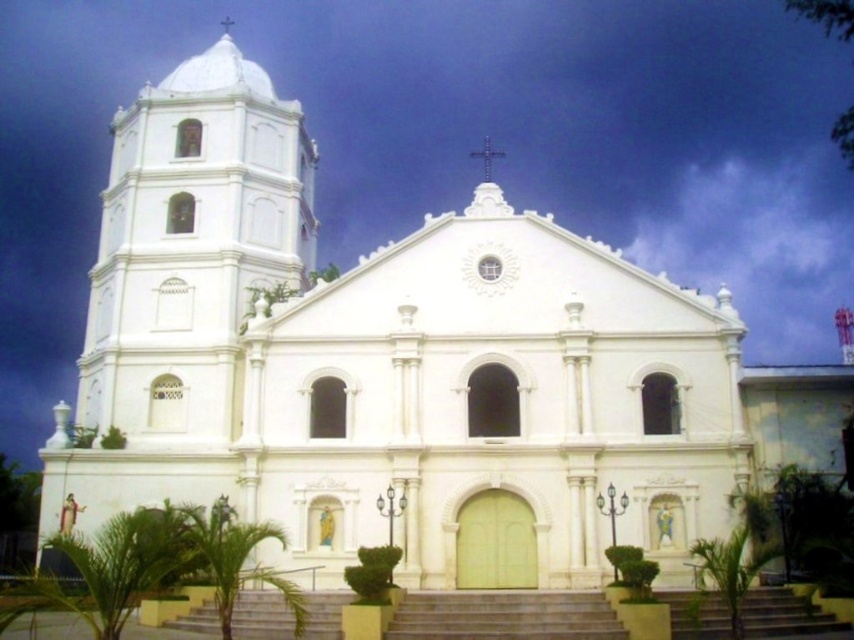
Question: Does smooth concrete stairs at center have a greater width compared to white stone cross at upper center?

Choices:
 (A) yes
 (B) no

Answer: (A)

Question: Based on their relative distances, which object is farther from the smooth concrete stairs at center?

Choices:
 (A) white smooth tower at left
 (B) white stone cross at upper center

Answer: (B)

Question: Is smooth concrete stairs at center thinner than white stone cross at upper center?

Choices:
 (A) yes
 (B) no

Answer: (B)

Question: Among these objects, which one is farthest from the camera?

Choices:
 (A) white smooth tower at left
 (B) white stone cross at upper center

Answer: (A)

Question: Considering the real-world distances, which object is farthest from the white stone cross at upper center?

Choices:
 (A) white smooth tower at left
 (B) smooth concrete stairs at center

Answer: (B)

Question: Does white smooth tower at left have a greater width compared to white stone cross at upper center?

Choices:
 (A) no
 (B) yes

Answer: (B)